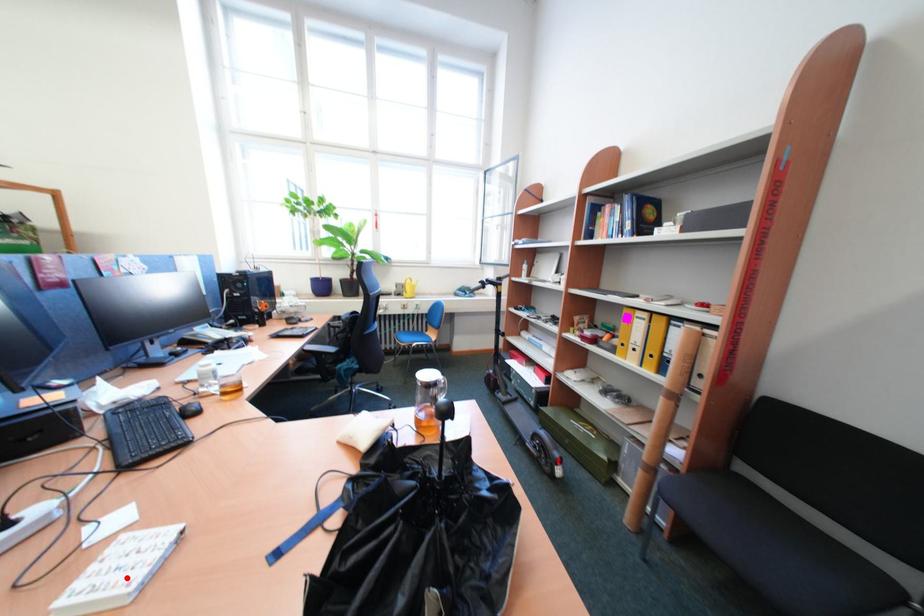
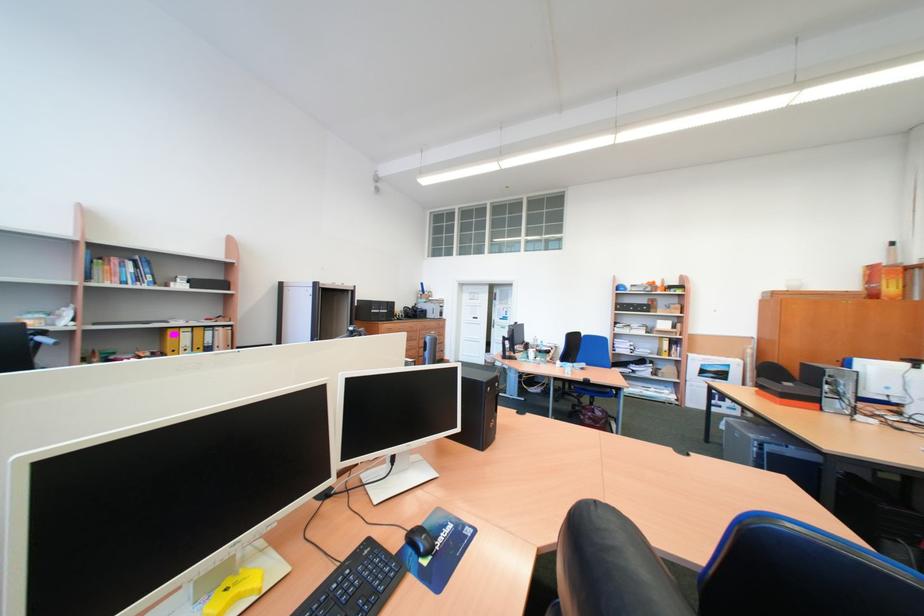
Question: I am providing you with two images of the same scene from different viewpoints. A red point is marked on the first image. At the location where the point appears in image 1, is it still visible in image 2?

Choices:
 (A) Yes
 (B) No

Answer: (B)